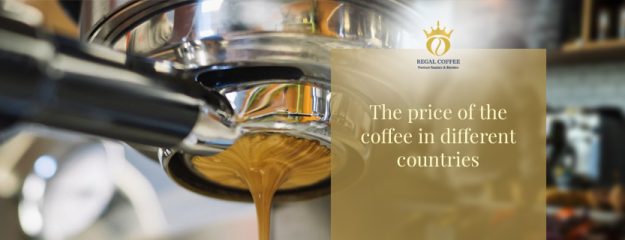
Where is `espresso machine`? The height and width of the screenshot is (240, 625). espresso machine is located at coordinates (272, 25).